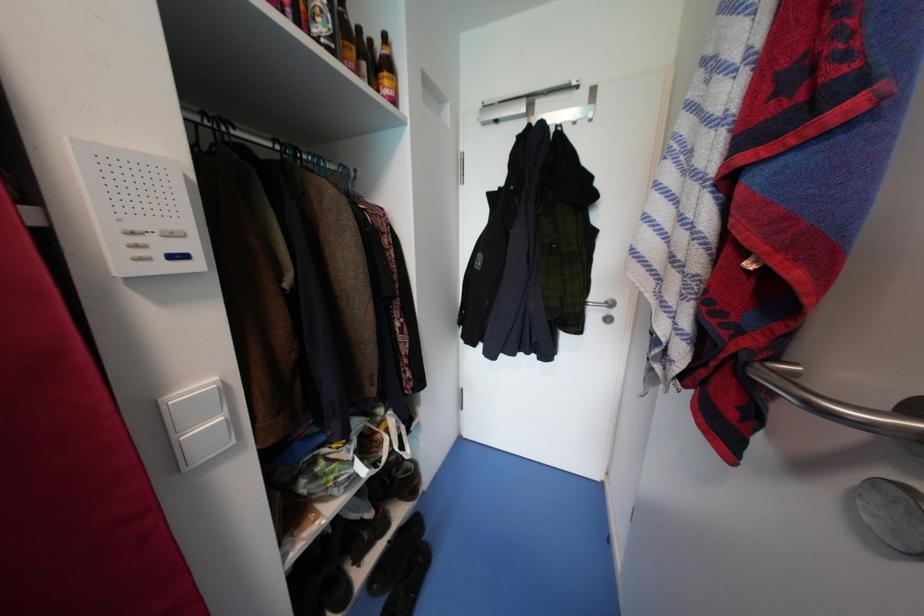
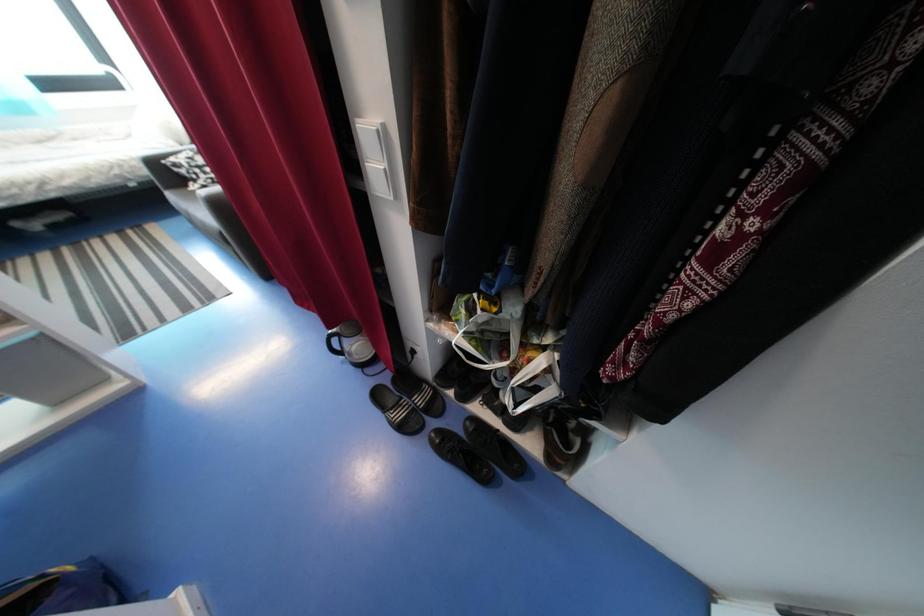
How did the camera likely rotate?

The camera rotated toward left-down.